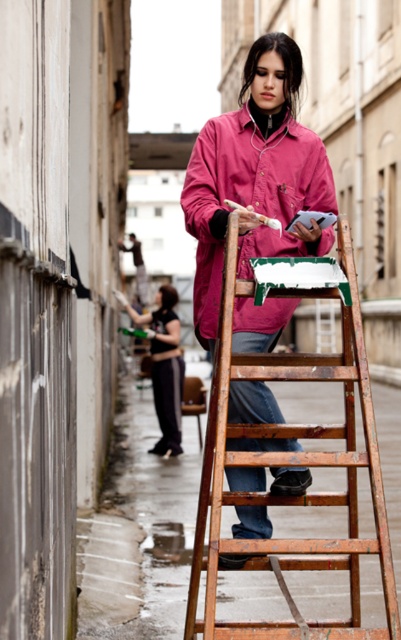
Question: Among these points, which one is farthest from the camera?

Choices:
 (A) (253, 209)
 (B) (172, 289)
 (C) (194, 176)
 (D) (253, 554)

Answer: (B)

Question: Can you confirm if pink matte jacket at center is positioned to the left of black fabric pants at lower center?

Choices:
 (A) yes
 (B) no

Answer: (B)

Question: Can you confirm if wooden at center is positioned to the right of matte pink jacket at center?

Choices:
 (A) no
 (B) yes

Answer: (B)

Question: Which is nearer to the matte pink jacket at center?

Choices:
 (A) pink matte jacket at center
 (B) wooden at center
 (C) black fabric pants at lower center

Answer: (A)

Question: Is pink matte jacket at center thinner than wooden at center?

Choices:
 (A) yes
 (B) no

Answer: (A)

Question: Among these points, which one is farthest from the camera?

Choices:
 (A) (265, 160)
 (B) (155, 397)
 (C) (214, 140)

Answer: (B)